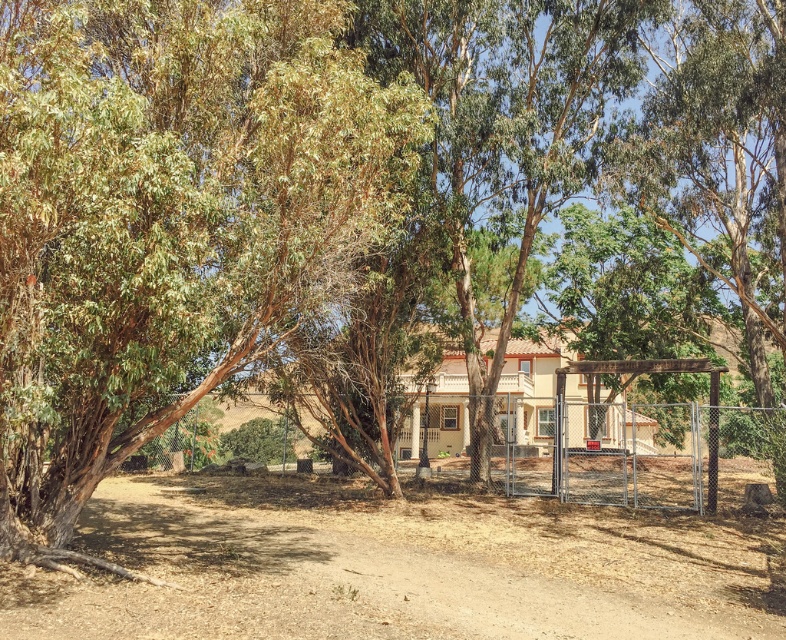
From the picture: You are a painter standing at the edge of the brown sandy dirt field at center and want to paint the green rough bark tree at left. Since you can only see the top of the tree, can you estimate its height relative to the field?

The green rough bark tree at left has a greater height compared to the brown sandy dirt field at center, so the tree is taller than the field.

You are standing in the suburban scene and want to place a small garden ornament. You have two options for placement marked as point 1 at coordinates point [261,298] and point 2 at coordinates point [432,580]. Which point is closer to you?

Point 1 at coordinates point [261,298] is closer to you than point 2 at coordinates point [432,580].